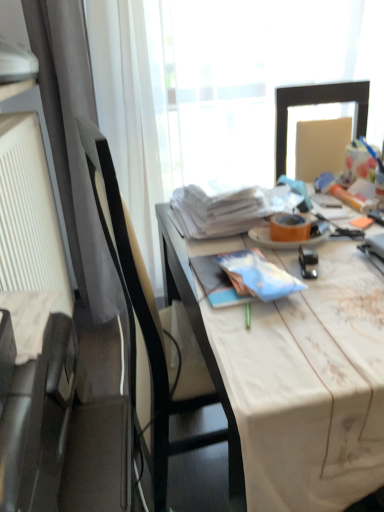
The width and height of the screenshot is (384, 512). I want to click on free location to the left of orange matte plate at center, so click(x=211, y=244).